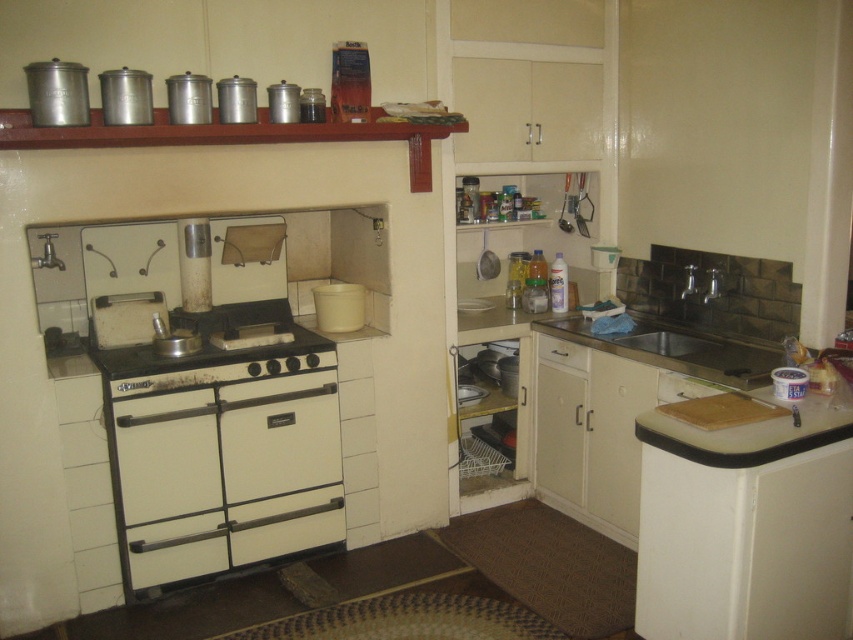
Question: Is white matte oven at center further to camera compared to metallic silver canister at upper left?

Choices:
 (A) no
 (B) yes

Answer: (B)

Question: Which of the following is the closest to the observer?

Choices:
 (A) (757, 401)
 (B) (117, 438)
 (C) (86, 116)

Answer: (A)

Question: Can you confirm if metallic silver canister at upper left is smaller than white matte drawer at center?

Choices:
 (A) yes
 (B) no

Answer: (A)

Question: Which object is closer to the camera taking this photo?

Choices:
 (A) white matte oven at center
 (B) metallic canister at upper left
 (C) stainless steel sink at lower right
 (D) metallic silver exhaust hood at upper center

Answer: (B)

Question: Is white matte gas stove at center to the right of metallic silver exhaust hood at upper center from the viewer's perspective?

Choices:
 (A) yes
 (B) no

Answer: (B)

Question: Which object is positioned closest to the metallic canister at upper left?

Choices:
 (A) white matte oven at center
 (B) metallic silver canister at upper left
 (C) metallic silver exhaust hood at upper center

Answer: (B)